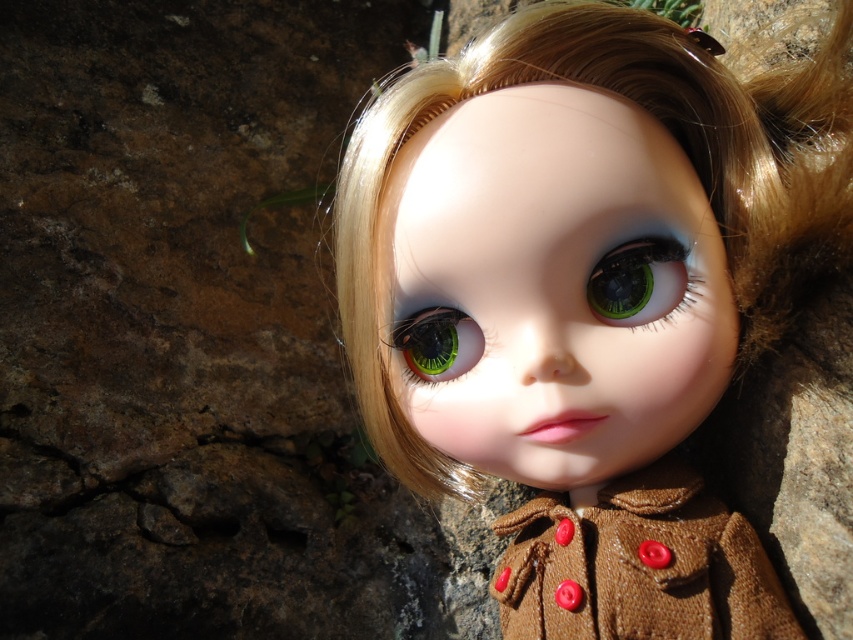
At what (x,y) coordinates should I click in order to perform the action: click on green matte eye at center. Please return your answer as a coordinate pair (x, y). This screenshot has height=640, width=853. Looking at the image, I should click on (637, 282).

Which is more to the left, green matte eye at center or green glossy eye at center?

green glossy eye at center is more to the left.

What do you see at coordinates (637, 282) in the screenshot? I see `green matte eye at center` at bounding box center [637, 282].

The width and height of the screenshot is (853, 640). I want to click on green matte eye at center, so click(637, 282).

Which of these two, matte brown coat at center or brown textured coat at center, stands shorter?

With less height is brown textured coat at center.

Between point (734, 81) and point (572, 636), which one is positioned behind?

Positioned behind is point (734, 81).

The width and height of the screenshot is (853, 640). In order to click on matte brown coat at center in this screenshot , I will do `click(584, 288)`.

Based on the photo, is the position of brown textured coat at center more distant than that of green glossy eye at center?

That is False.

Is brown textured coat at center to the left of green glossy eye at center from the viewer's perspective?

No, brown textured coat at center is not to the left of green glossy eye at center.

You are a GUI agent. You are given a task and a screenshot of the screen. Output one action in this format:
    pyautogui.click(x=<x>, y=<y>)
    Task: Click on the brown textured coat at center
    
    Given the screenshot: What is the action you would take?
    pyautogui.click(x=637, y=564)